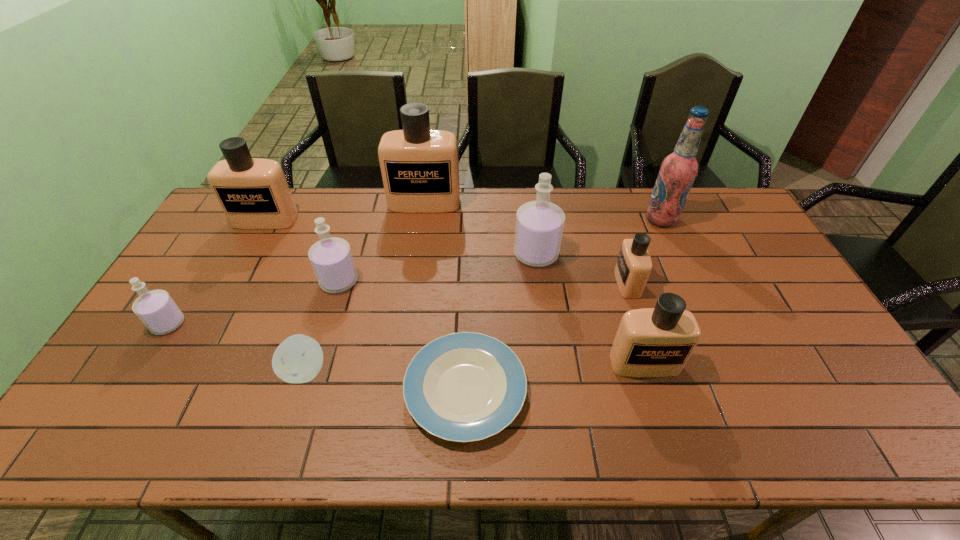
Where is `alcohol that is at the far edge`? The width and height of the screenshot is (960, 540). alcohol that is at the far edge is located at coordinates (678, 170).

You are a GUI agent. You are given a task and a screenshot of the screen. Output one action in this format:
    pyautogui.click(x=<x>, y=<y>)
    Task: Click on the object located in the near edge section of the desktop
    
    Given the screenshot: What is the action you would take?
    pyautogui.click(x=463, y=387)

This screenshot has height=540, width=960. In order to click on object positioned at the far left corner in this screenshot , I will do `click(253, 192)`.

The image size is (960, 540). In order to click on vacant region at the far edge of the desktop in this screenshot , I will do `click(311, 189)`.

In the image, there is a desktop. Identify the location of vacant space at the near edge. The image size is (960, 540). (390, 424).

Locate an element on the screen. vacant space at the left edge of the desktop is located at coordinates (208, 248).

Where is `vacant region at the right edge of the desktop`? The image size is (960, 540). vacant region at the right edge of the desktop is located at coordinates (830, 356).

You are a GUI agent. You are given a task and a screenshot of the screen. Output one action in this format:
    pyautogui.click(x=<x>, y=<y>)
    Task: Click on the free space at the far right corner of the desktop
    Image resolution: width=960 pixels, height=540 pixels.
    Given the screenshot: What is the action you would take?
    pyautogui.click(x=714, y=217)

Find the location of a particular element. This screenshot has width=960, height=540. empty space that is in between the third perfume from right to left and the white apple is located at coordinates (420, 313).

Where is `unoccupied area between the second purple perfume from left to right and the second shortest object`? unoccupied area between the second purple perfume from left to right and the second shortest object is located at coordinates (323, 326).